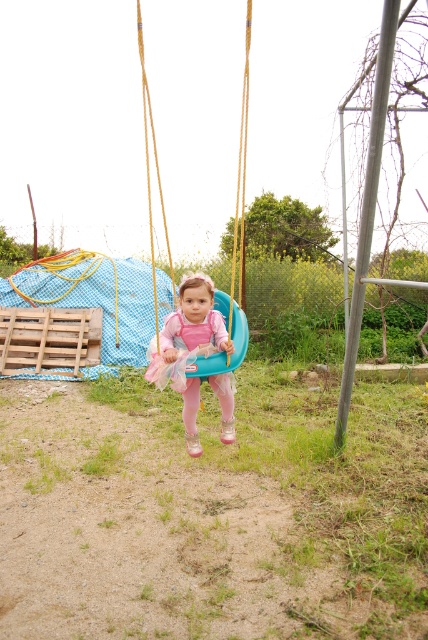
Can you confirm if pink tulle dress at center is wider than teal plastic swing at center?

In fact, pink tulle dress at center might be narrower than teal plastic swing at center.

Does pink tulle dress at center lie behind teal plastic swing at center?

That is False.

Where is `pink tulle dress at center`? This screenshot has height=640, width=428. pink tulle dress at center is located at coordinates (190, 324).